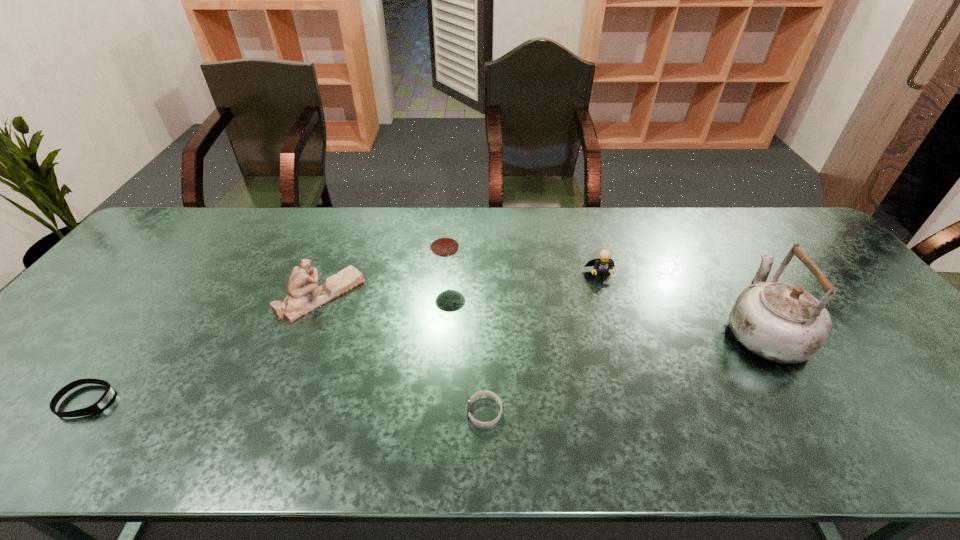
Image resolution: width=960 pixels, height=540 pixels. Identify the location of vacant point located between the fifth object from left to right and the fourth object from right to left. (523, 275).

Locate an element on the screen. free space between the fifth object from right to left and the third object from left to right is located at coordinates (384, 286).

At what (x,y) coordinates should I click in order to perform the action: click on free space that is in between the right wristband and the leftmost object. Please return your answer as a coordinate pair (x, y). Image resolution: width=960 pixels, height=540 pixels. Looking at the image, I should click on (286, 406).

Identify the location of vacant area that lies between the fourth object from left to right and the third shortest object. (542, 343).

Find the location of a particular element. This screenshot has width=960, height=540. object that is the closest to the second object from left to right is located at coordinates (444, 244).

You are a GUI agent. You are given a task and a screenshot of the screen. Output one action in this format:
    pyautogui.click(x=<x>, y=<y>)
    Task: Click on the object that stands as the third closest to the right wristband
    
    Given the screenshot: What is the action you would take?
    point(602,265)

At what (x,y) coordinates should I click in order to perform the action: click on vacant area that satisfies the following two spatial constraints: 1. on the front-facing side of the second object from right to left; 2. on the front-facing side of the figurine. Please return your answer as a coordinate pair (x, y). This screenshot has height=540, width=960. Looking at the image, I should click on (607, 295).

Image resolution: width=960 pixels, height=540 pixels. Identify the location of vacant region that satisfies the following two spatial constraints: 1. on the front-facing side of the Lego; 2. on the display of the left wristband. (638, 401).